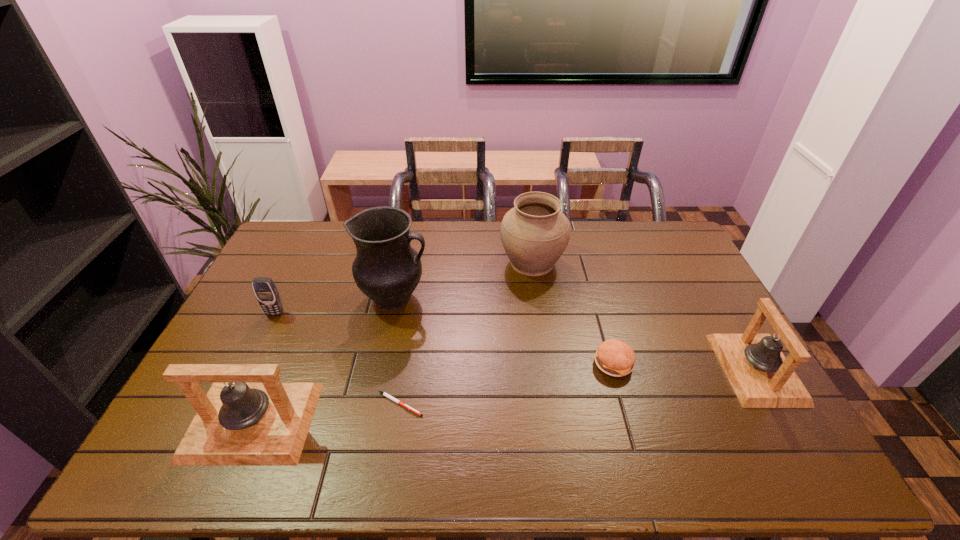
Please mark a free spot for a new bell to balance the arrangement. Please provide its 2D coordinates. Your answer should be formatted as a tuple, i.e. [(x, y)], where the tuple contains the x and y coordinates of a point satisfying the conditions above.

[(517, 394)]